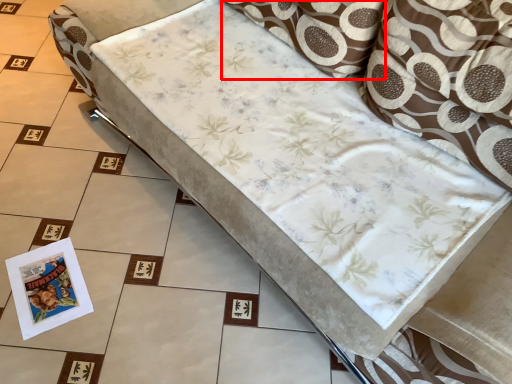
Question: From the image's perspective, considering the relative positions of pillow (annotated by the red box) and throw pillow in the image provided, where is pillow (annotated by the red box) located with respect to the staircase?

Choices:
 (A) above
 (B) below

Answer: (A)